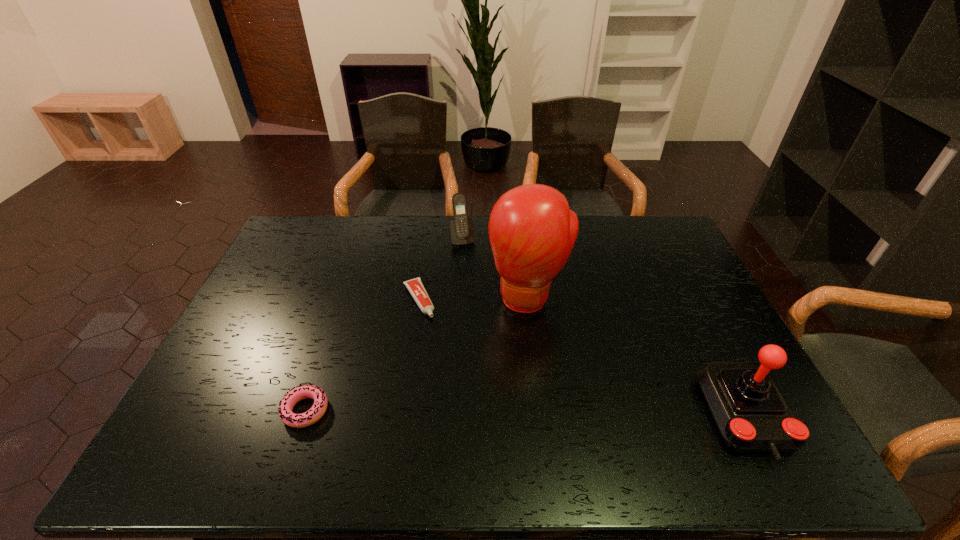
Identify the location of free space located 0.390m at the nozzle of the toothpaste. (481, 425).

Locate an element on the screen. This screenshot has height=540, width=960. vacant space located 0.090m at the nozzle of the toothpaste is located at coordinates (435, 339).

Locate an element on the screen. This screenshot has width=960, height=540. free space located 0.130m on the front-facing side of the third object from left to right is located at coordinates [472, 268].

Identify the location of free space located 0.400m on the front-facing side of the third object from left to right. (490, 326).

Locate an element on the screen. This screenshot has height=540, width=960. free space located on the front-facing side of the third object from left to right is located at coordinates (472, 268).

Locate an element on the screen. free space located 0.200m on the striking surface of the second object from right to left is located at coordinates (513, 378).

The height and width of the screenshot is (540, 960). Find the location of `free space located 0.210m on the striking surface of the second object from right to left`. free space located 0.210m on the striking surface of the second object from right to left is located at coordinates (512, 381).

Identify the location of vacant space located on the striking surface of the second object from right to left. (512, 381).

You are a GUI agent. You are given a task and a screenshot of the screen. Output one action in this format:
    pyautogui.click(x=<x>, y=<y>)
    Task: Click on the object located at the far edge
    The height and width of the screenshot is (540, 960).
    Given the screenshot: What is the action you would take?
    pyautogui.click(x=462, y=231)

Identify the location of doughnut situated at the near edge. The width and height of the screenshot is (960, 540). [x=301, y=392].